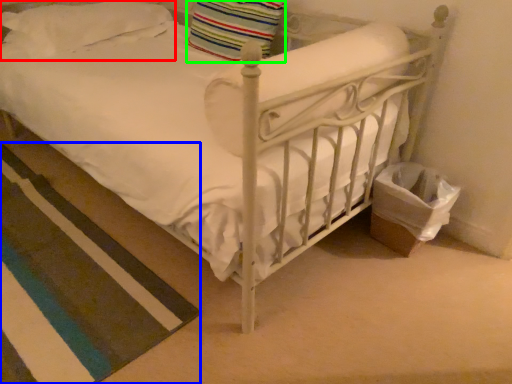
Question: Based on their relative distances, which object is farther from pillow (highlighted by a red box)? Choose from strip (highlighted by a blue box) and pillow (highlighted by a green box).

Choices:
 (A) strip
 (B) pillow

Answer: (A)